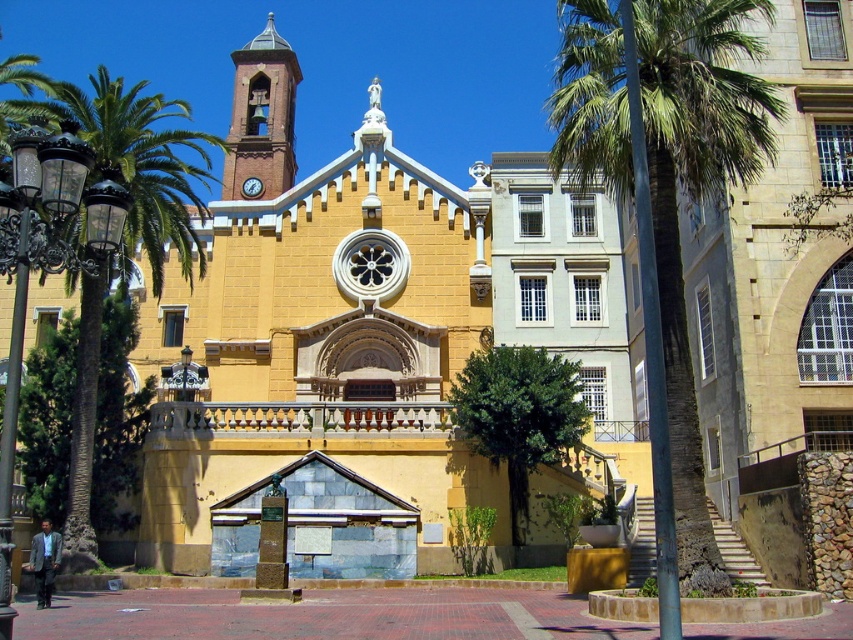
Who is higher up, green leafy palm tree at right or brick stonework bell tower at upper center?

Positioned higher is brick stonework bell tower at upper center.

Which is in front, point (605, 16) or point (283, 138)?

Positioned in front is point (605, 16).

The height and width of the screenshot is (640, 853). What are the coordinates of `green leafy palm tree at right` in the screenshot? It's located at (695, 200).

Is point (764, 99) behind point (250, 182)?

No, (764, 99) is closer to viewer.

Can you confirm if green leafy palm tree at right is smaller than metallic clock at center?

No, green leafy palm tree at right is not smaller than metallic clock at center.

Is point (598, 116) in front of point (251, 189)?

Yes, point (598, 116) is in front of point (251, 189).

You are a GUI agent. You are given a task and a screenshot of the screen. Output one action in this format:
    pyautogui.click(x=<x>, y=<y>)
    Task: Click on the green leafy palm tree at right
    This screenshot has width=853, height=640.
    Given the screenshot: What is the action you would take?
    pyautogui.click(x=695, y=200)

Can you confirm if green leafy palm tree at left is positioned to the left of metallic clock at center?

Indeed, green leafy palm tree at left is positioned on the left side of metallic clock at center.

From the picture: Who is more forward, (x=173, y=193) or (x=250, y=192)?

Point (x=173, y=193) is more forward.

Is point (86, 307) closer to viewer compared to point (248, 177)?

Yes, point (86, 307) is in front of point (248, 177).

Locate an element on the screen. This screenshot has height=640, width=853. green leafy palm tree at left is located at coordinates (144, 160).